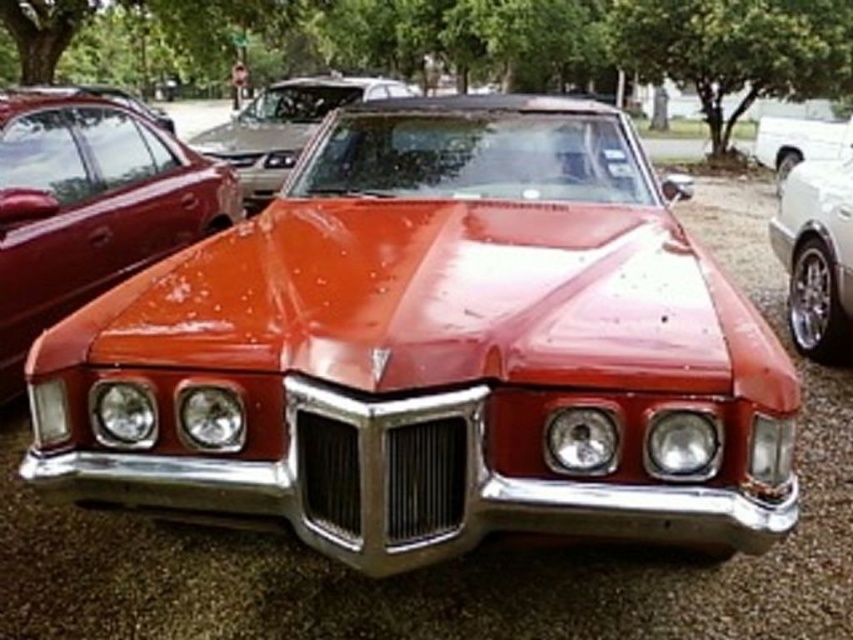
Question: Is shiny metallic car at center positioned behind glossy metallic car at right?

Choices:
 (A) yes
 (B) no

Answer: (B)

Question: Estimate the real-world distances between objects in this image. Which object is closer to the shiny metallic car at center?

Choices:
 (A) glossy metallic car at right
 (B) shiny white truck at right

Answer: (A)

Question: Which of the following is the closest to the observer?

Choices:
 (A) glossy red car at center
 (B) shiny white truck at right
 (C) glossy metallic car at right
 (D) shiny metallic car at center

Answer: (D)

Question: Can you confirm if shiny metallic car at center is bigger than glossy red car at center?

Choices:
 (A) no
 (B) yes

Answer: (A)

Question: Which of the following is the farthest from the observer?

Choices:
 (A) shiny white truck at right
 (B) glossy red car at center
 (C) shiny metallic car at center

Answer: (A)

Question: Can you confirm if shiny metallic car at center is positioned above glossy red car at center?

Choices:
 (A) no
 (B) yes

Answer: (A)